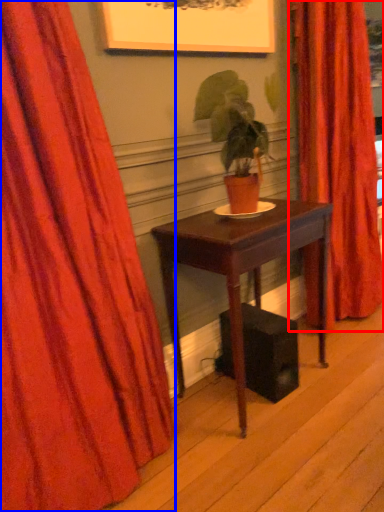
Question: Which object appears farthest to the camera in this image, curtain (highlighted by a red box) or curtain (highlighted by a blue box)?

Choices:
 (A) curtain
 (B) curtain

Answer: (A)